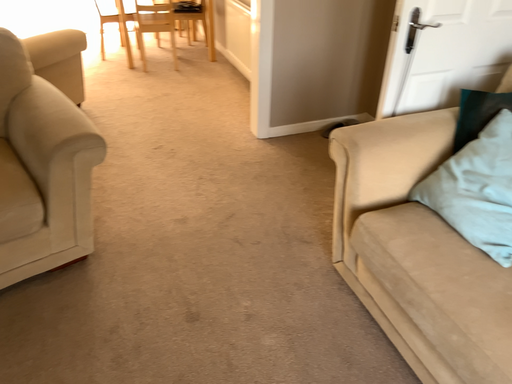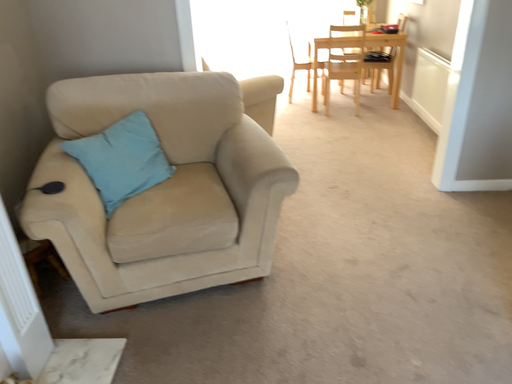
Question: How did the camera likely rotate when shooting the video?

Choices:
 (A) rotated upward
 (B) rotated downward

Answer: (A)